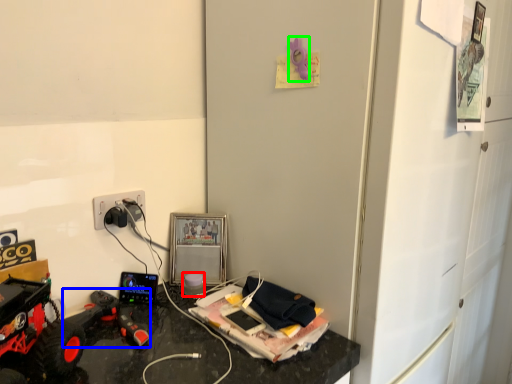
Question: Which is nearer to the toy (highlighted by a red box)? toy (highlighted by a blue box) or toy (highlighted by a green box).

Choices:
 (A) toy
 (B) toy

Answer: (A)